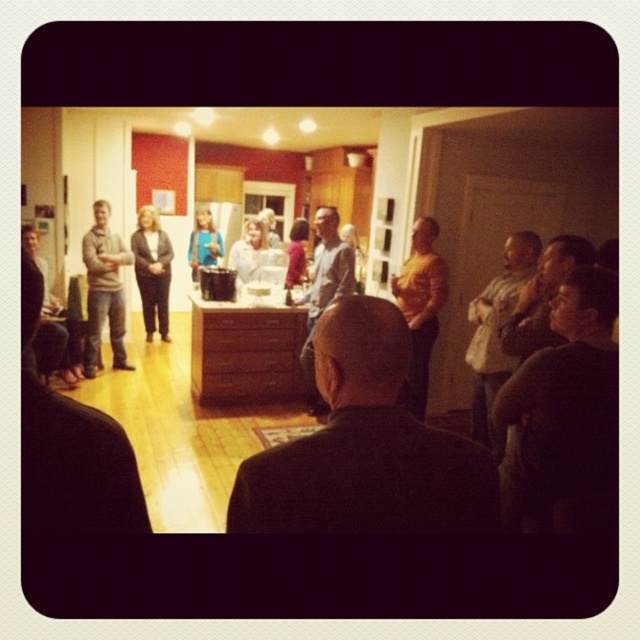
Can you confirm if orange shirt at center is shorter than dark brown leather jacket at lower right?

In fact, orange shirt at center may be taller than dark brown leather jacket at lower right.

Between orange shirt at center and dark brown leather jacket at lower right, which one has less height?

Standing shorter between the two is dark brown leather jacket at lower right.

Image resolution: width=640 pixels, height=640 pixels. What do you see at coordinates (420, 307) in the screenshot? I see `orange shirt at center` at bounding box center [420, 307].

Find the location of a particular element. This screenshot has width=640, height=640. orange shirt at center is located at coordinates (420, 307).

Does point (472, 352) come closer to viewer compared to point (122, 314)?

Yes, point (472, 352) is in front of point (122, 314).

Where is `light brown leather jacket at right`? Image resolution: width=640 pixels, height=640 pixels. light brown leather jacket at right is located at coordinates (497, 333).

Who is more forward, (532, 262) or (93, 298)?

Point (532, 262) is in front.

Where is `light brown leather jacket at right`? The image size is (640, 640). light brown leather jacket at right is located at coordinates (497, 333).

Consider the image. Is light brown sweater at left bigger than light brown leather jacket at right?

No.

Does point (140, 496) come in front of point (520, 278)?

Yes.

Find the location of a particular element. The image size is (640, 640). light brown sweater at left is located at coordinates (70, 449).